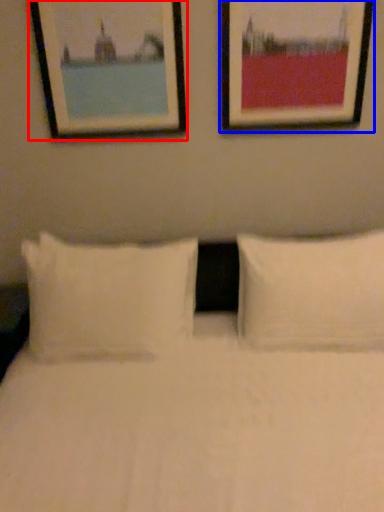
Question: Which object appears farthest to the camera in this image, picture frame (highlighted by a red box) or picture frame (highlighted by a blue box)?

Choices:
 (A) picture frame
 (B) picture frame

Answer: (A)